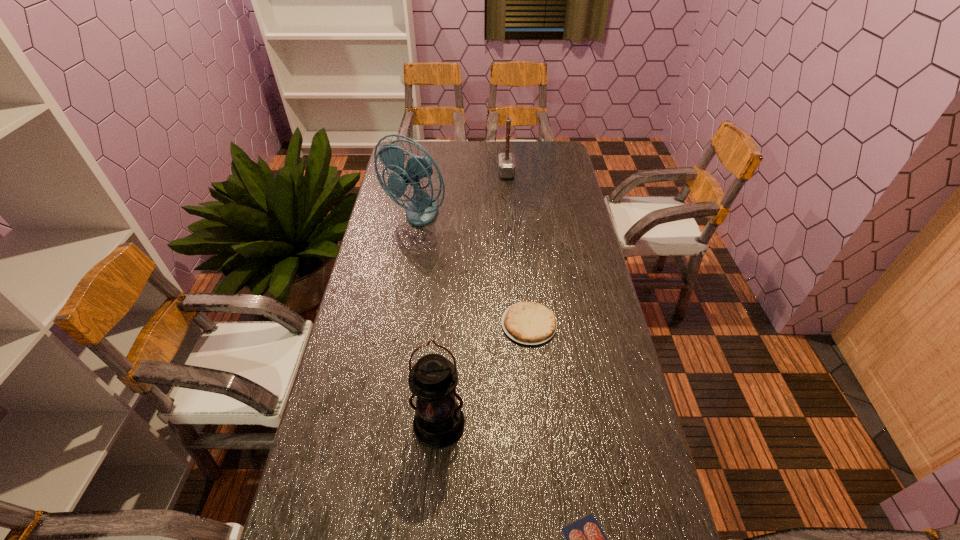
This screenshot has height=540, width=960. What are the coordinates of `vacant space that satisfies the following two spatial constraints: 1. on the striking surface of the tortilla; 2. on the left side of the farthest object` in the screenshot? It's located at (518, 324).

The image size is (960, 540). Identify the location of free point that satisfies the following two spatial constraints: 1. on the striking surface of the hammer; 2. on the back side of the fourth tallest object. (518, 324).

Find the location of `vacant region that satisfies the following two spatial constraints: 1. on the striking surface of the farthest object; 2. above the lantern, indicating its light source`. vacant region that satisfies the following two spatial constraints: 1. on the striking surface of the farthest object; 2. above the lantern, indicating its light source is located at coordinates (526, 426).